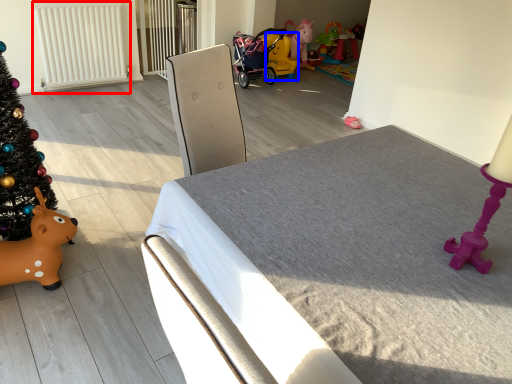
Question: Which of the following is the closest to the observer, radiator (highlighted by a red box) or toy (highlighted by a blue box)?

Choices:
 (A) radiator
 (B) toy

Answer: (A)